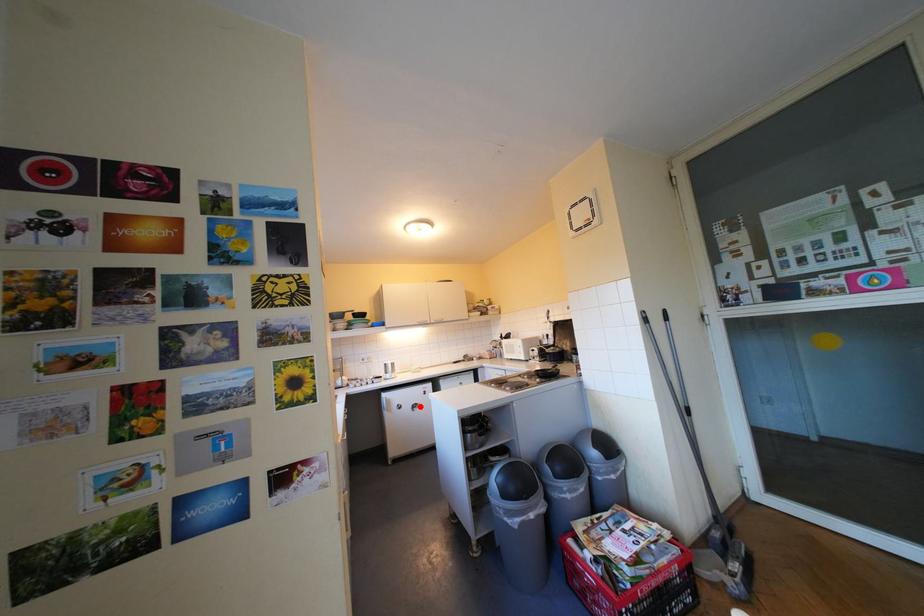
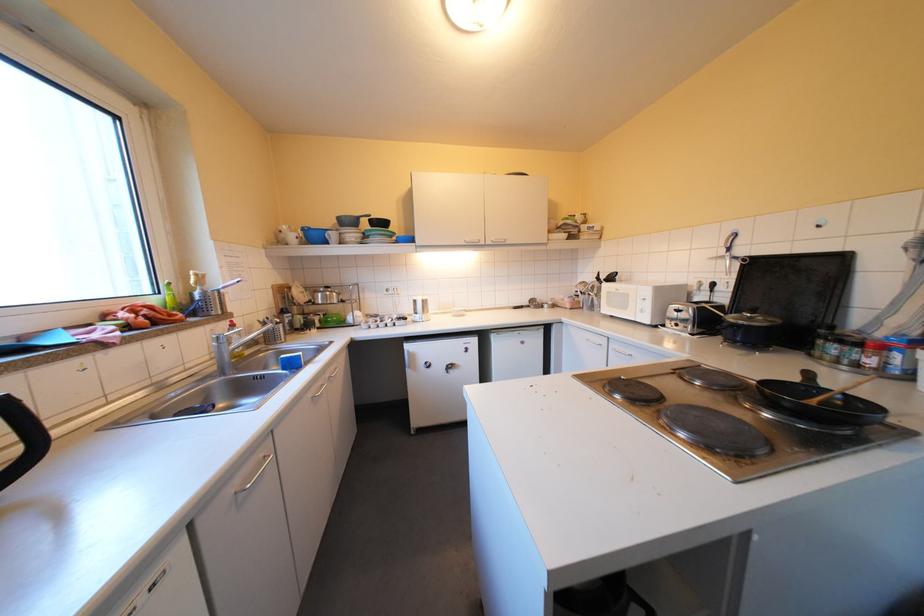
In the second image, find the point that corresponds to the highlighted location in the first image.

(452, 366)